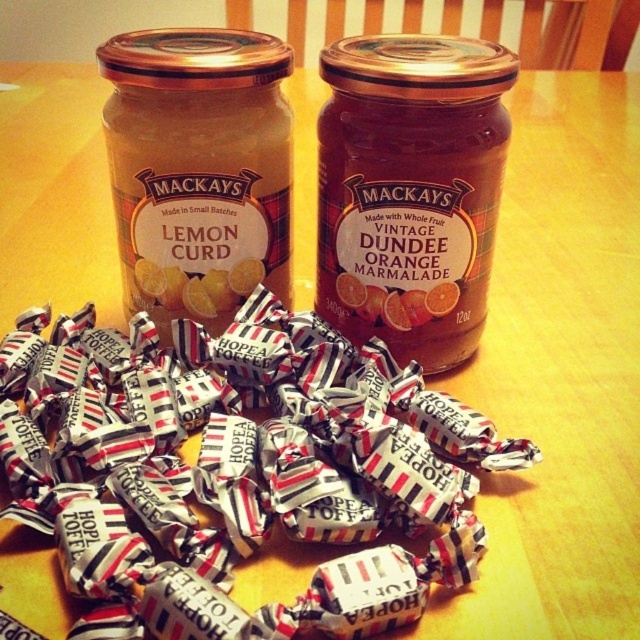
You are a customer at a store and see the image. You want to buy the jar of Mackays Lemon Curd. Where should you look in relation to the point marked at coordinates [410,189]?

The matte glass jar at center is located at point [410,189]. Since the jar on the left contains Mackays Lemon Curd, you should look to the left of the point marked at [410,189] to find the Mackays Lemon Curd.

You are a customer at a store and see the white striped paper wrapped toffee at center. Where exactly is it located on the image?

The white striped paper wrapped toffee at center is located at point (237, 470).

In the scene shown: You are arranging items on a table for a party. You have a matte glass jar at center and a matte glass jar at left. According to the scene, where should you place a decorative plate that needs to go between these two jars?

The decorative plate should be placed between the matte glass jar at left and the matte glass jar at center since the matte glass jar at center is below the matte glass jar at left, creating space in between for the plate.